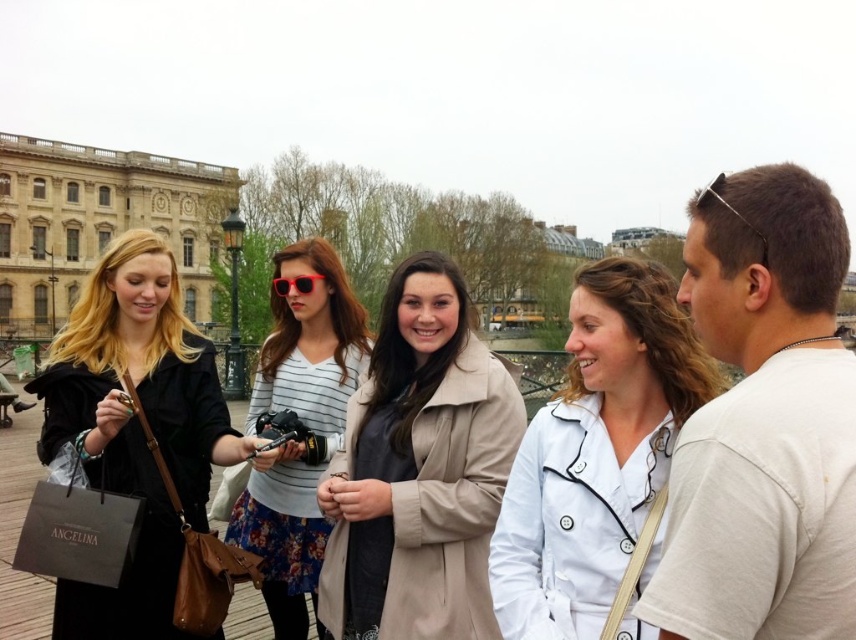
You are standing on the wooden bridge and want to walk towards the point that is closer to you. Which point should you walk towards, point (830, 568) or point (272, 300)?

You should walk towards point (830, 568) because it is closer to the viewer than point (272, 300).